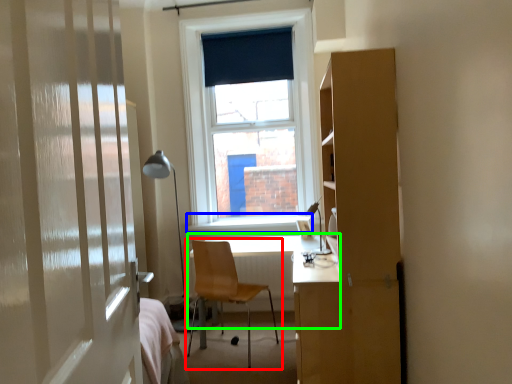
Question: Which is nearer to the chair (highlighted by a red box)? window sill (highlighted by a blue box) or table (highlighted by a green box).

Choices:
 (A) window sill
 (B) table

Answer: (A)